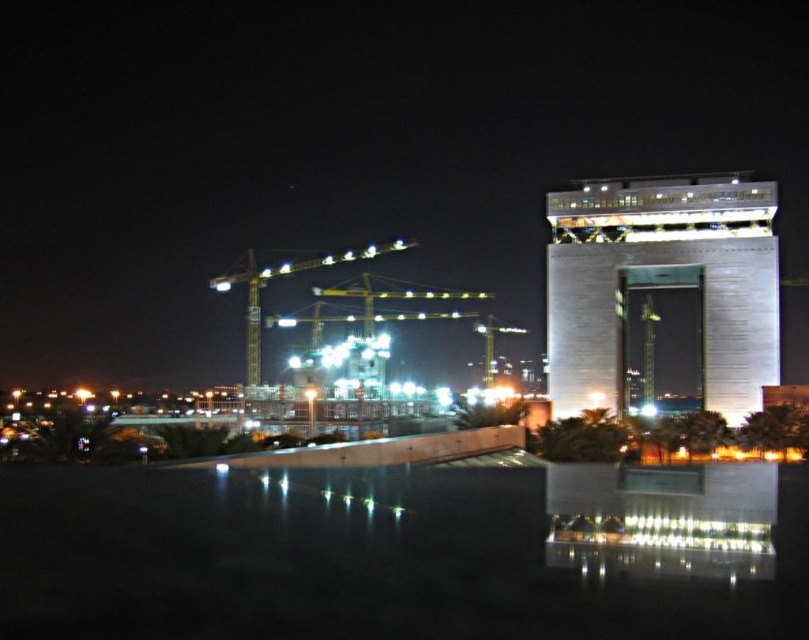
Question: Which of the following is the farthest from the observer?

Choices:
 (A) (595, 340)
 (B) (671, 536)
 (C) (244, 374)

Answer: (C)

Question: Is matte concrete construction site at center in front of sleek gray building at upper right?

Choices:
 (A) no
 (B) yes

Answer: (B)

Question: Which point appears farthest from the camera in this image?

Choices:
 (A) (356, 256)
 (B) (344, 598)

Answer: (A)

Question: Can you confirm if matte concrete construction site at center is smaller than sleek gray building at upper right?

Choices:
 (A) yes
 (B) no

Answer: (A)

Question: Does sleek gray building at upper right have a lesser width compared to yellow metallic crane at center?

Choices:
 (A) yes
 (B) no

Answer: (A)

Question: Estimate the real-world distances between objects in this image. Which object is farther from the matte concrete construction site at center?

Choices:
 (A) yellow metallic crane at center
 (B) sleek gray building at upper right

Answer: (A)